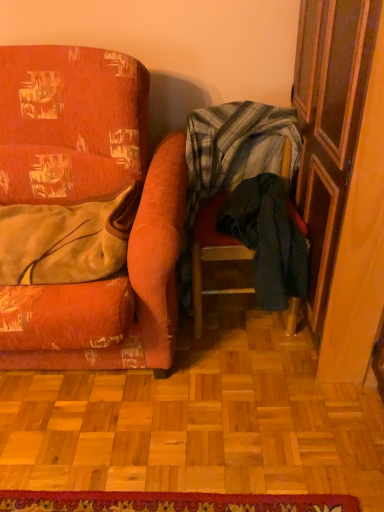
The height and width of the screenshot is (512, 384). I want to click on free space that is in between plaid fabric chair at center, the second chair from the left, and red woven mat at lower center, so click(201, 423).